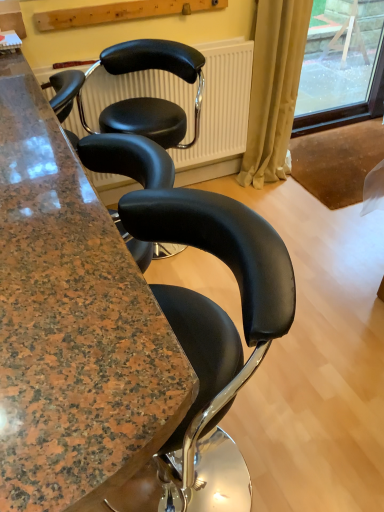
Question: From the image's perspective, is beige fabric curtain at right above or below granite countertop at center?

Choices:
 (A) above
 (B) below

Answer: (A)

Question: Do you think beige fabric curtain at right is within granite countertop at center, or outside of it?

Choices:
 (A) outside
 (B) inside

Answer: (A)

Question: Which object is positioned farthest from the transparent glass window at upper right?

Choices:
 (A) granite countertop at center
 (B) black leather chair at center
 (C) beige fabric curtain at right

Answer: (A)

Question: Based on their relative distances, which object is nearer to the transparent glass window at upper right?

Choices:
 (A) beige fabric curtain at right
 (B) granite countertop at center
 (C) black leather chair at center

Answer: (A)